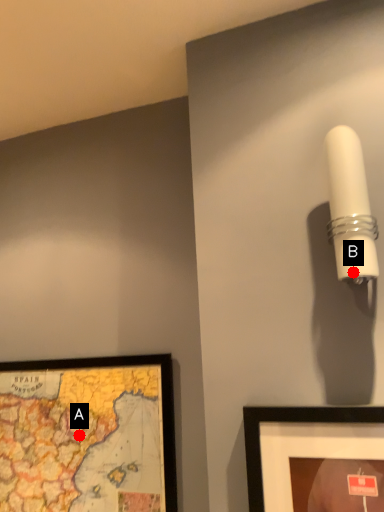
Question: Two points are circled on the image, labeled by A and B beside each circle. Which point is further to the camera?

Choices:
 (A) A is further
 (B) B is further

Answer: (A)